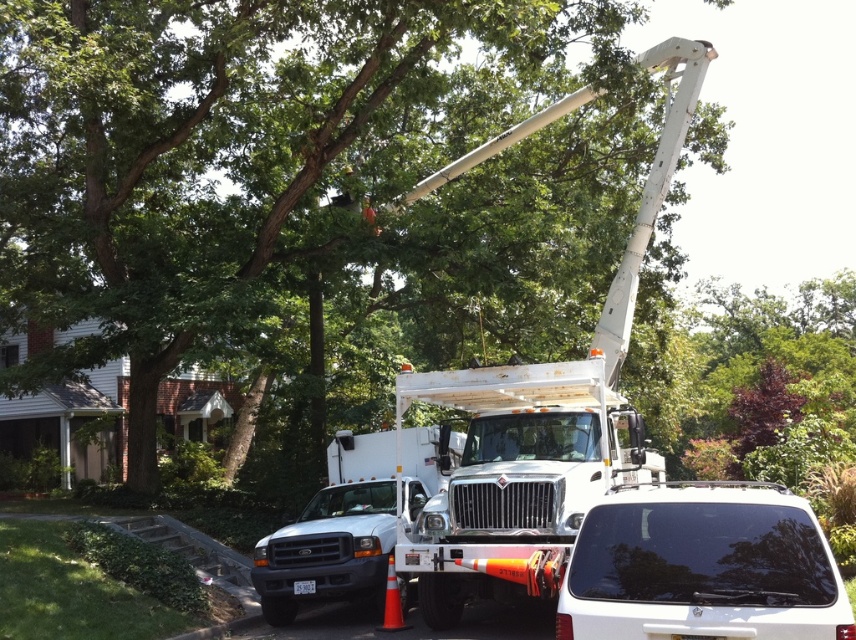
Question: Which point is closer to the camera taking this photo?

Choices:
 (A) (140, 13)
 (B) (648, 461)

Answer: (B)

Question: Is black glass suv at lower right thinner than white matte truck at center?

Choices:
 (A) yes
 (B) no

Answer: (A)

Question: Can you confirm if green leafy tree at center is positioned to the left of white metallic utility truck at center?

Choices:
 (A) no
 (B) yes

Answer: (B)

Question: Which of these objects is positioned closest to the white metallic utility truck at center?

Choices:
 (A) black glass suv at lower right
 (B) white metallic bucket truck at center

Answer: (B)

Question: Does white metallic bucket truck at center lie behind black glass suv at lower right?

Choices:
 (A) yes
 (B) no

Answer: (A)

Question: Which of the following is the closest to the observer?

Choices:
 (A) black glass suv at lower right
 (B) white metallic utility truck at center

Answer: (A)